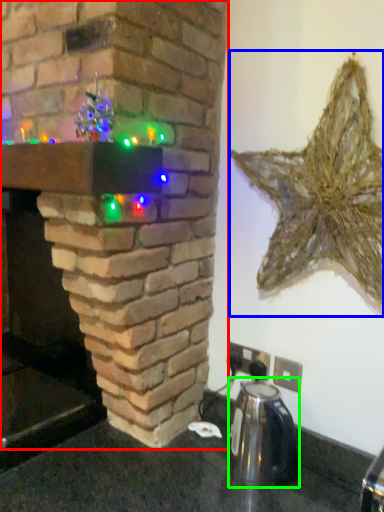
Question: Which object is positioned closest to fireplace (highlighted by a red box)? Select from star (highlighted by a blue box) and appliance (highlighted by a green box).

Choices:
 (A) star
 (B) appliance

Answer: (A)